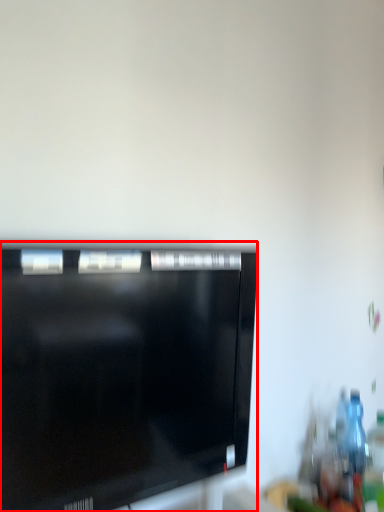
Question: From the image's perspective, what is the correct spatial positioning of television (annotated by the red box) in reference to bottle?

Choices:
 (A) above
 (B) below

Answer: (A)